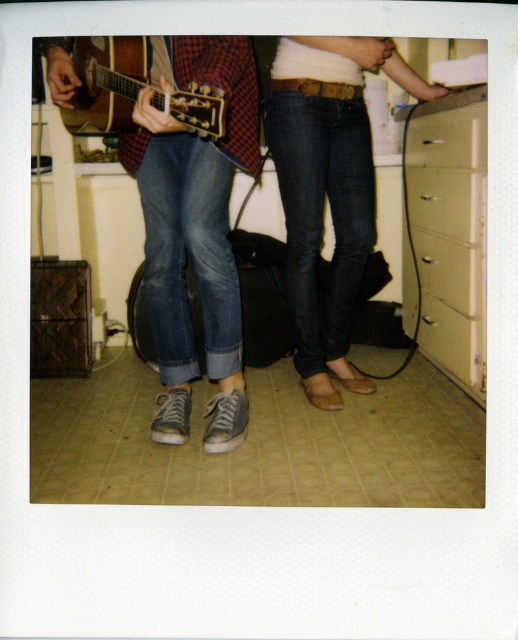
Question: Which point appears closest to the camera in this image?

Choices:
 (A) (358, 90)
 (B) (174, 156)
 (C) (433, 150)
 (D) (412, 163)

Answer: (B)

Question: Can you confirm if matte wood drawer at right is positioned above matte wood drawer at lower right?

Choices:
 (A) yes
 (B) no

Answer: (A)

Question: Can you confirm if matte wood drawer at lower right is smaller than matte white drawer at center right?

Choices:
 (A) yes
 (B) no

Answer: (B)

Question: Is beige plastic file cabinet at right smaller than matte wood drawer at lower right?

Choices:
 (A) no
 (B) yes

Answer: (A)

Question: Among these points, which one is farthest from the camera?

Choices:
 (A) (408, 333)
 (B) (88, 99)
 (C) (478, 384)
 (D) (341, 60)

Answer: (A)

Question: Which object is the farthest from the matte brown acoustic guitar at left?

Choices:
 (A) matte wood drawer at right
 (B) beige plastic file cabinet at right
 (C) matte white drawer at center right

Answer: (C)